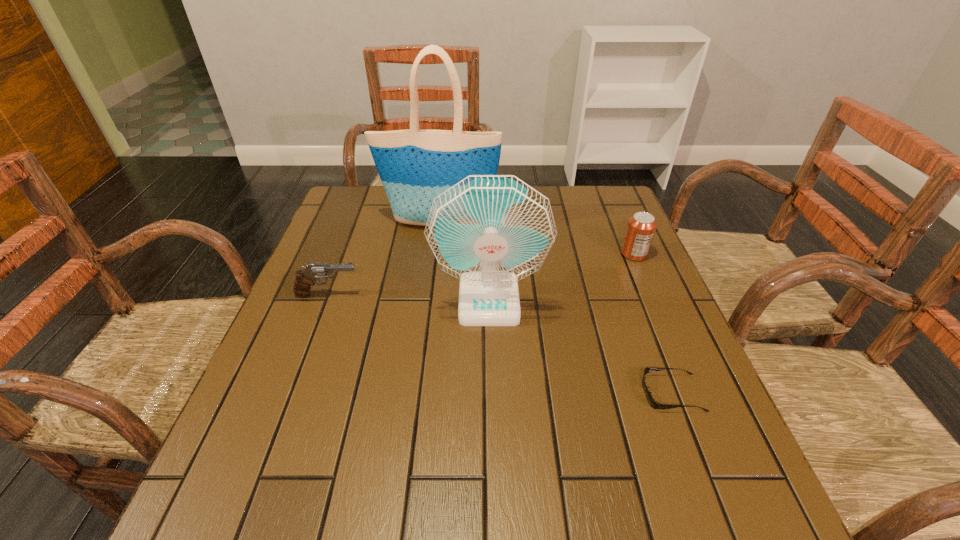
Identify the location of free point at the far edge. This screenshot has height=540, width=960. pos(546,195).

The width and height of the screenshot is (960, 540). In order to click on vacant area at the near edge in this screenshot , I will do `click(484, 532)`.

Find the location of a particular element. vacant space at the left edge is located at coordinates (336, 364).

Locate an element on the screen. The image size is (960, 540). free space at the right edge is located at coordinates tap(626, 300).

Find the location of a particular element. free space at the far left corner of the desktop is located at coordinates (374, 215).

This screenshot has width=960, height=540. In the image, there is a desktop. What are the coordinates of `vacant area at the near left corner` in the screenshot? It's located at (232, 508).

What are the coordinates of `vacant space at the far right corner` in the screenshot? It's located at (572, 204).

Find the location of a particular element. empty space between the second farthest object and the fourth shortest object is located at coordinates (562, 277).

The image size is (960, 540). Identify the location of vacant space that is in between the pistol and the tallest object. (384, 259).

Identify the location of vacant region between the fourth shortest object and the shortest object. (581, 346).